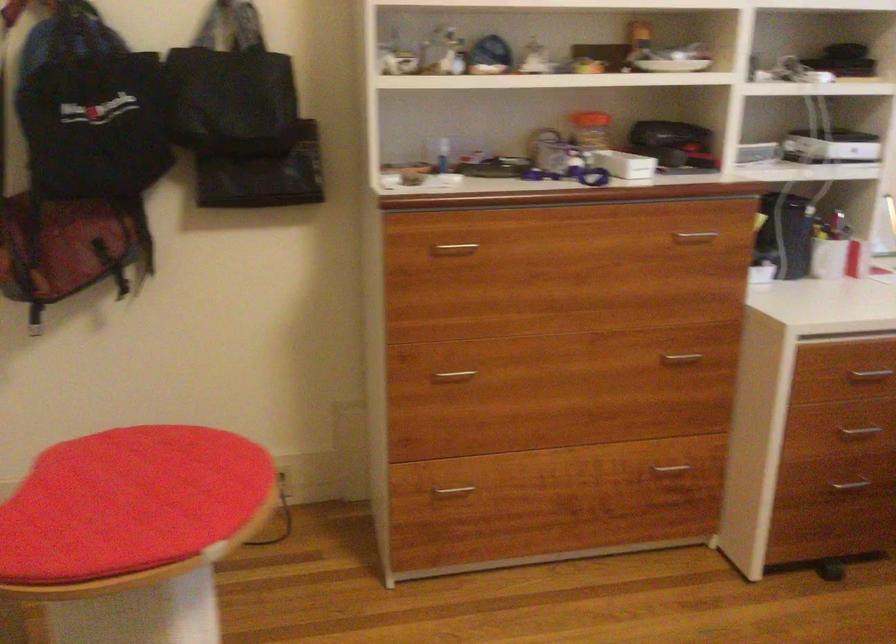
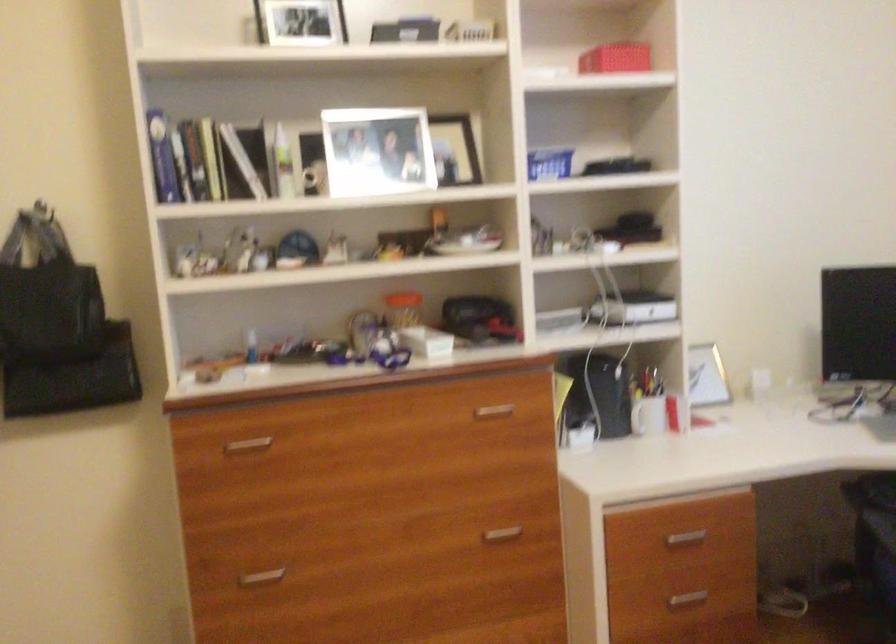
Question: How did the camera likely rotate?

Choices:
 (A) Left
 (B) Right
 (C) Up
 (D) Down

Answer: (C)